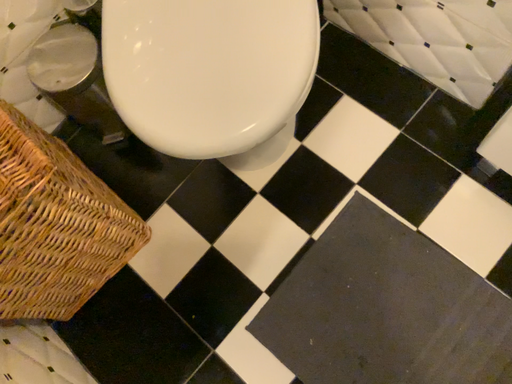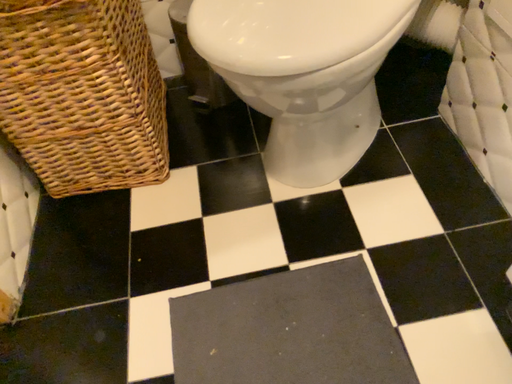
Question: How did the camera likely rotate when shooting the video?

Choices:
 (A) rotated downward
 (B) rotated upward

Answer: (B)